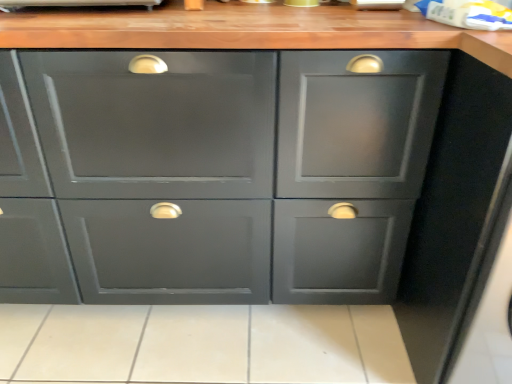
Describe the element at coordinates (202, 344) in the screenshot. I see `beige tile at lower center` at that location.

The width and height of the screenshot is (512, 384). In order to click on beige tile at lower center in this screenshot , I will do `click(202, 344)`.

Image resolution: width=512 pixels, height=384 pixels. What do you see at coordinates (234, 170) in the screenshot?
I see `matte gray cabinet at center` at bounding box center [234, 170].

Identify the location of matte gray cabinet at center. (234, 170).

Where is `beige tile at lower center`? beige tile at lower center is located at coordinates (202, 344).

Considering the positions of objects matte gray cabinet at center and beige tile at lower center in the image provided, who is more to the right, matte gray cabinet at center or beige tile at lower center?

From the viewer's perspective, beige tile at lower center appears more on the right side.

Which object is further away from the camera taking this photo, matte gray cabinet at center or beige tile at lower center?

beige tile at lower center is more distant.

Is point (83, 227) closer to viewer compared to point (147, 350)?

Yes, point (83, 227) is in front of point (147, 350).

From the image's perspective, is matte gray cabinet at center on top of beige tile at lower center?

Yes, from the image's perspective, matte gray cabinet at center is on top of beige tile at lower center.

From a real-world perspective, does matte gray cabinet at center sit lower than beige tile at lower center?

Result: Incorrect, from a real-world perspective, matte gray cabinet at center is higher than beige tile at lower center.

Considering the sizes of matte gray cabinet at center and beige tile at lower center in the image, is matte gray cabinet at center wider or thinner than beige tile at lower center?

Considering their sizes, matte gray cabinet at center looks slimmer than beige tile at lower center.

Considering the sizes of objects matte gray cabinet at center and beige tile at lower center in the image provided, who is shorter, matte gray cabinet at center or beige tile at lower center?

Standing shorter between the two is beige tile at lower center.

Can you confirm if matte gray cabinet at center is bigger than beige tile at lower center?

Yes, matte gray cabinet at center is bigger than beige tile at lower center.

Is matte gray cabinet at center completely or partially outside of beige tile at lower center?

Yes, matte gray cabinet at center is located beyond the bounds of beige tile at lower center.

Looking at this image, is matte gray cabinet at center not close to beige tile at lower center?

No, matte gray cabinet at center is not far away from beige tile at lower center.

Is matte gray cabinet at center facing towards beige tile at lower center?

No, matte gray cabinet at center is not facing towards beige tile at lower center.

What's the angular difference between matte gray cabinet at center and beige tile at lower center's facing directions?

The angle between the facing direction of matte gray cabinet at center and the facing direction of beige tile at lower center is 91.3 degrees.

How much distance is there between matte gray cabinet at center and beige tile at lower center?

matte gray cabinet at center and beige tile at lower center are 15.88 inches apart from each other.

Locate an element on the screen. tile that appears below the matte gray cabinet at center (from the image's perspective) is located at coordinates (202, 344).

Is beige tile at lower center to the right of matte gray cabinet at center from the viewer's perspective?

Correct, you'll find beige tile at lower center to the right of matte gray cabinet at center.

Considering the positions of objects beige tile at lower center and matte gray cabinet at center in the image provided, who is behind, beige tile at lower center or matte gray cabinet at center?

beige tile at lower center is further from the camera.

Considering the positions of point (170, 366) and point (134, 232), is point (170, 366) closer or farther from the camera than point (134, 232)?

Point (170, 366) is farther from the camera than point (134, 232).

From the image's perspective, would you say beige tile at lower center is shown under matte gray cabinet at center?

Indeed, from the image's perspective, beige tile at lower center is shown beneath matte gray cabinet at center.

From a real-world perspective, who is located lower, beige tile at lower center or matte gray cabinet at center?

Answer: beige tile at lower center.

Which object is thinner, beige tile at lower center or matte gray cabinet at center?

With smaller width is matte gray cabinet at center.

Considering the sizes of objects beige tile at lower center and matte gray cabinet at center in the image provided, who is shorter, beige tile at lower center or matte gray cabinet at center?

With less height is beige tile at lower center.

Which of these two, beige tile at lower center or matte gray cabinet at center, is bigger?

matte gray cabinet at center.

Is matte gray cabinet at center surrounded by beige tile at lower center?

That's incorrect, matte gray cabinet at center is not inside beige tile at lower center.

Is beige tile at lower center far from matte gray cabinet at center?

No.

Could you tell me if beige tile at lower center is facing matte gray cabinet at center?

No, beige tile at lower center does not turn towards matte gray cabinet at center.

Can you tell me how much beige tile at lower center and matte gray cabinet at center differ in facing direction?

91.3 degrees.

This screenshot has width=512, height=384. I want to click on tile below the matte gray cabinet at center (from the image's perspective), so click(202, 344).

You are a GUI agent. You are given a task and a screenshot of the screen. Output one action in this format:
    pyautogui.click(x=<x>, y=<y>)
    Task: Click on the cabinetry positioned vertically above the beige tile at lower center (from a real-world perspective)
    The height and width of the screenshot is (384, 512).
    Given the screenshot: What is the action you would take?
    pyautogui.click(x=234, y=170)

The width and height of the screenshot is (512, 384). I want to click on cabinetry located in front of the beige tile at lower center, so click(234, 170).